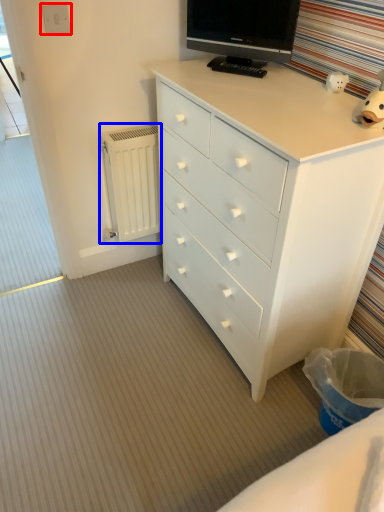
Question: Among these objects, which one is nearest to the camera, electric outlet (highlighted by a red box) or radiator (highlighted by a blue box)?

Choices:
 (A) electric outlet
 (B) radiator

Answer: (A)